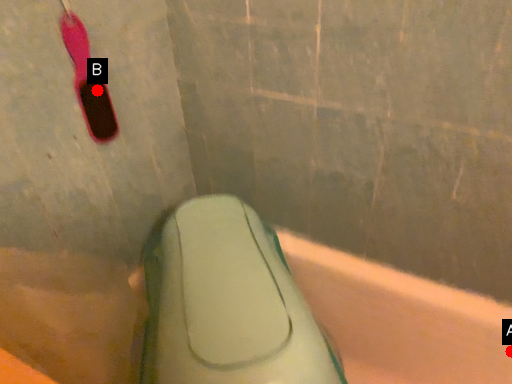
Question: Two points are circled on the image, labeled by A and B beside each circle. Which of the following is the farthest from the observer?

Choices:
 (A) A is further
 (B) B is further

Answer: (A)